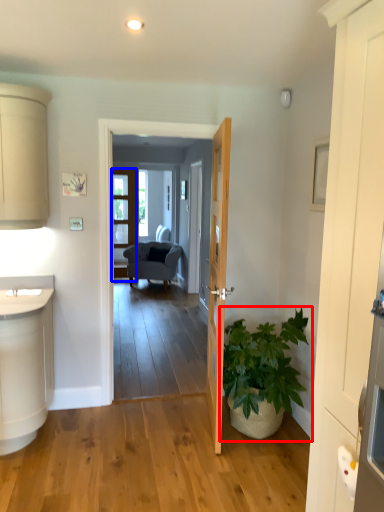
Question: Among these objects, which one is farthest to the camera, houseplant (highlighted by a red box) or screen door (highlighted by a blue box)?

Choices:
 (A) houseplant
 (B) screen door

Answer: (B)